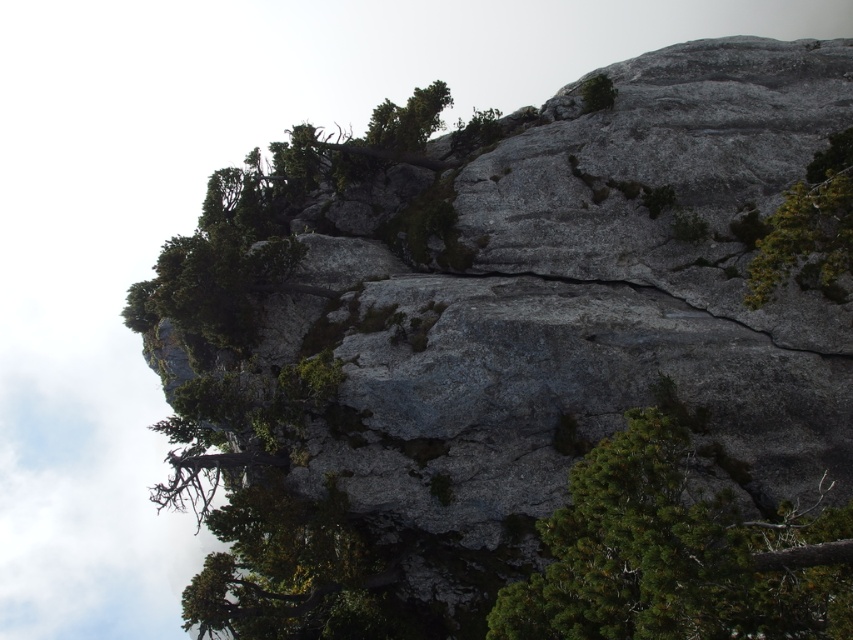
Question: Which of the following is the closest to the observer?

Choices:
 (A) green leafy tree at upper center
 (B) green needle-like at center

Answer: (B)

Question: Which object appears closest to the camera in this image?

Choices:
 (A) green leafy tree at upper center
 (B) green leafy tree at upper right
 (C) green needle-like at center

Answer: (C)

Question: Which point is farther from the camera taking this photo?

Choices:
 (A) (817, 282)
 (B) (817, 557)
 (C) (599, 100)

Answer: (C)

Question: Can you confirm if green leafy tree at upper right is positioned above green leafy tree at upper center?

Choices:
 (A) yes
 (B) no

Answer: (B)

Question: Does green needle-like at center have a larger size compared to green leafy tree at upper right?

Choices:
 (A) no
 (B) yes

Answer: (B)

Question: Can you confirm if green leafy tree at upper right is positioned to the left of green leafy tree at upper center?

Choices:
 (A) yes
 (B) no

Answer: (B)